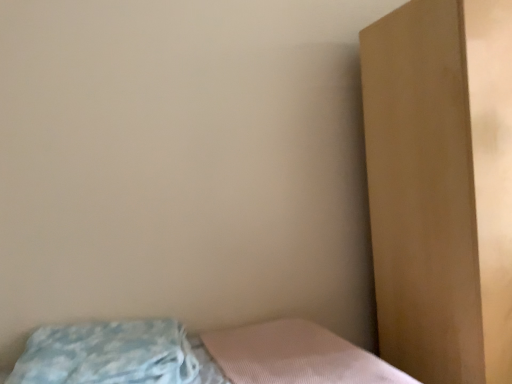
What is the approximate height of blue textured pillow at lower left?

It is 17.77 centimeters.

This screenshot has width=512, height=384. Describe the element at coordinates (108, 354) in the screenshot. I see `blue textured pillow at lower left` at that location.

The width and height of the screenshot is (512, 384). What are the coordinates of `blue textured pillow at lower left` in the screenshot? It's located at (108, 354).

What do you see at coordinates (441, 187) in the screenshot? I see `brown matte dresser at right` at bounding box center [441, 187].

Where is `brown matte dresser at right`? brown matte dresser at right is located at coordinates (441, 187).

In order to face brown matte dresser at right, should I rotate leftwards or rightwards?

It's best to rotate right around 28.064 degrees.

The image size is (512, 384). Identify the location of blue textured pillow at lower left. (108, 354).

Which object is positioned more to the left, brown matte dresser at right or blue textured pillow at lower left?

Positioned to the left is blue textured pillow at lower left.

Which object is closer to the camera, brown matte dresser at right or blue textured pillow at lower left?

blue textured pillow at lower left is closer to the camera.

In the scene shown: Which is closer, (390, 118) or (45, 373)?

Point (390, 118) is farther from the camera than point (45, 373).

From the image's perspective, would you say brown matte dresser at right is positioned over blue textured pillow at lower left?

Yes, from the image's perspective, brown matte dresser at right is above blue textured pillow at lower left.

From a real-world perspective, is brown matte dresser at right located higher than blue textured pillow at lower left?

Yes, from a real-world perspective, brown matte dresser at right is over blue textured pillow at lower left

Considering the sizes of brown matte dresser at right and blue textured pillow at lower left in the image, is brown matte dresser at right wider or thinner than blue textured pillow at lower left?

Clearly, brown matte dresser at right has more width compared to blue textured pillow at lower left.

Considering the relative sizes of brown matte dresser at right and blue textured pillow at lower left in the image provided, is brown matte dresser at right taller than blue textured pillow at lower left?

Indeed, brown matte dresser at right has a greater height compared to blue textured pillow at lower left.

Based on the photo, does brown matte dresser at right have a smaller size compared to blue textured pillow at lower left?

No, brown matte dresser at right is not smaller than blue textured pillow at lower left.

Is blue textured pillow at lower left a part of brown matte dresser at right?

No, blue textured pillow at lower left is not inside brown matte dresser at right.

Would you consider brown matte dresser at right to be distant from blue textured pillow at lower left?

Indeed, brown matte dresser at right is not near blue textured pillow at lower left.

Is brown matte dresser at right looking in the opposite direction of blue textured pillow at lower left?

brown matte dresser at right is not turned away from blue textured pillow at lower left.

This screenshot has width=512, height=384. I want to click on pillow lying below the brown matte dresser at right (from the image's perspective), so [x=108, y=354].

Which is more to the left, blue textured pillow at lower left or brown matte dresser at right?

Positioned to the left is blue textured pillow at lower left.

Who is more distant, blue textured pillow at lower left or brown matte dresser at right?

brown matte dresser at right.

Between point (124, 376) and point (460, 298), which one is positioned behind?

The point (460, 298) is farther.

From the image's perspective, does blue textured pillow at lower left appear higher than brown matte dresser at right?

Actually, blue textured pillow at lower left appears below brown matte dresser at right in the image.

From a real-world perspective, is blue textured pillow at lower left on top of brown matte dresser at right?

Incorrect, from a real-world perspective, blue textured pillow at lower left is lower than brown matte dresser at right.

Considering the sizes of objects blue textured pillow at lower left and brown matte dresser at right in the image provided, who is wider, blue textured pillow at lower left or brown matte dresser at right?

Wider between the two is brown matte dresser at right.

In terms of height, does blue textured pillow at lower left look taller or shorter compared to brown matte dresser at right?

Considering their sizes, blue textured pillow at lower left has less height than brown matte dresser at right.

Looking at the image, does blue textured pillow at lower left seem bigger or smaller compared to brown matte dresser at right?

In the image, blue textured pillow at lower left appears to be smaller than brown matte dresser at right.

Is blue textured pillow at lower left located outside brown matte dresser at right?

blue textured pillow at lower left is positioned outside brown matte dresser at right.

Would you say blue textured pillow at lower left is a long distance from brown matte dresser at right?

Yes.

Could you tell me if blue textured pillow at lower left is turned towards brown matte dresser at right?

No, blue textured pillow at lower left is not turned towards brown matte dresser at right.

How different are the orientations of blue textured pillow at lower left and brown matte dresser at right in degrees?

There is a 180-degree angle between the facing directions of blue textured pillow at lower left and brown matte dresser at right.

This screenshot has width=512, height=384. In order to click on dresser above the blue textured pillow at lower left (from the image's perspective) in this screenshot , I will do `click(441, 187)`.

Locate an element on the screen. This screenshot has width=512, height=384. dresser that is behind the blue textured pillow at lower left is located at coordinates (441, 187).

Where is `dresser located on the right of blue textured pillow at lower left`? This screenshot has height=384, width=512. dresser located on the right of blue textured pillow at lower left is located at coordinates (441, 187).